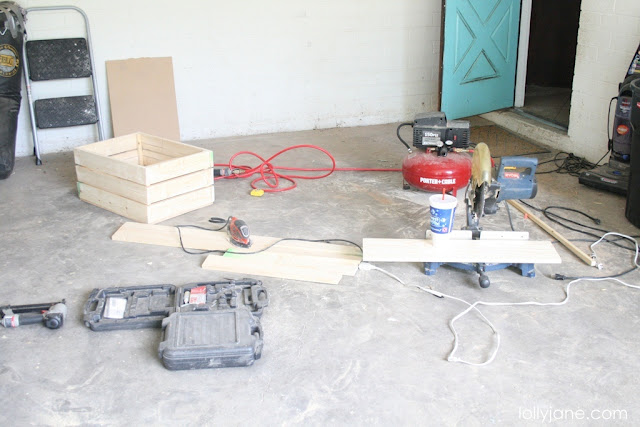
Identify the location of concrete floor. (377, 383).